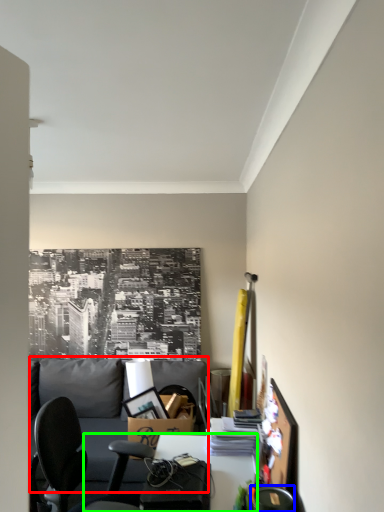
Question: Which object is positioned closest to couch (highlighted by a red box)? Select from chair (highlighted by a blue box) and desk (highlighted by a green box).

Choices:
 (A) chair
 (B) desk

Answer: (B)